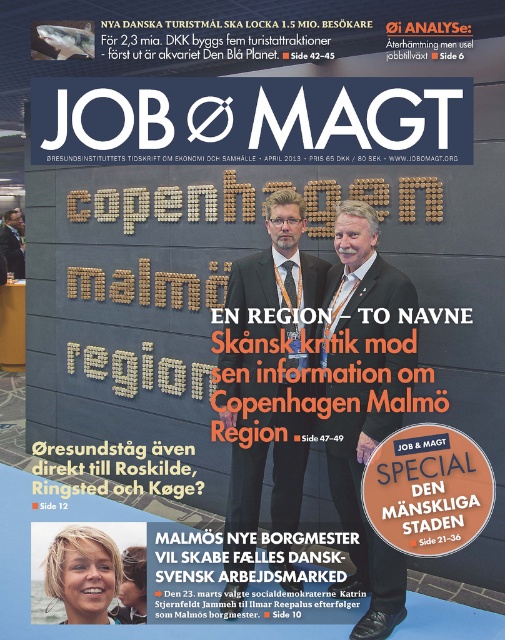
Which is behind, point (77, 588) or point (9, 253)?

The point (9, 253) is behind.

Locate an element on the screen. blonde hair at upper center is located at coordinates pos(83,573).

Which is behind, point (243, 273) or point (364, 378)?

Point (243, 273)

Who is higher up, dark suit at center or white textured suit at center?

dark suit at center is higher up.

Who is more distant from viewer, (227, 412) or (361, 428)?

The point (227, 412) is more distant.

Identify the location of dark suit at center. (268, 392).

Is point (234, 573) positioned behind point (15, 227)?

No, it is in front of (15, 227).

Between point (282, 451) and point (18, 209), which one is positioned behind?

The point (18, 209) is behind.

Is point (252, 253) positioned after point (1, 228)?

No.

Locate an element on the screen. dark suit at center is located at coordinates (268, 392).